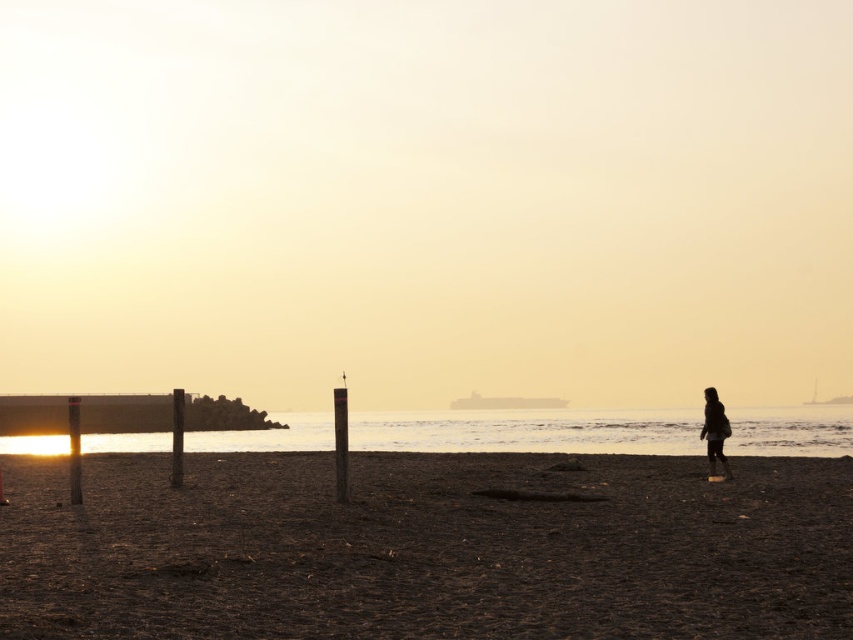
Consider the image. You are standing on the beach and want to place your dark textured coat at right on the dark sand at lower center. Will the coat be fully visible above the sand?

The dark sand at lower center has a greater height compared to the dark textured coat at right, so the coat will not be fully visible above the sand as the sand is taller than the coat.